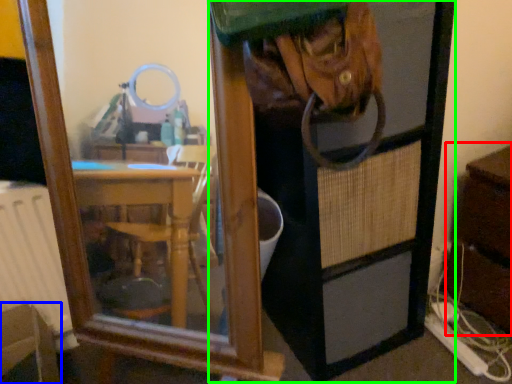
Question: Considering the real-world distances, which object is closest to dresser (highlighted by a red box)? furniture (highlighted by a blue box) or screen door (highlighted by a green box).

Choices:
 (A) furniture
 (B) screen door

Answer: (B)